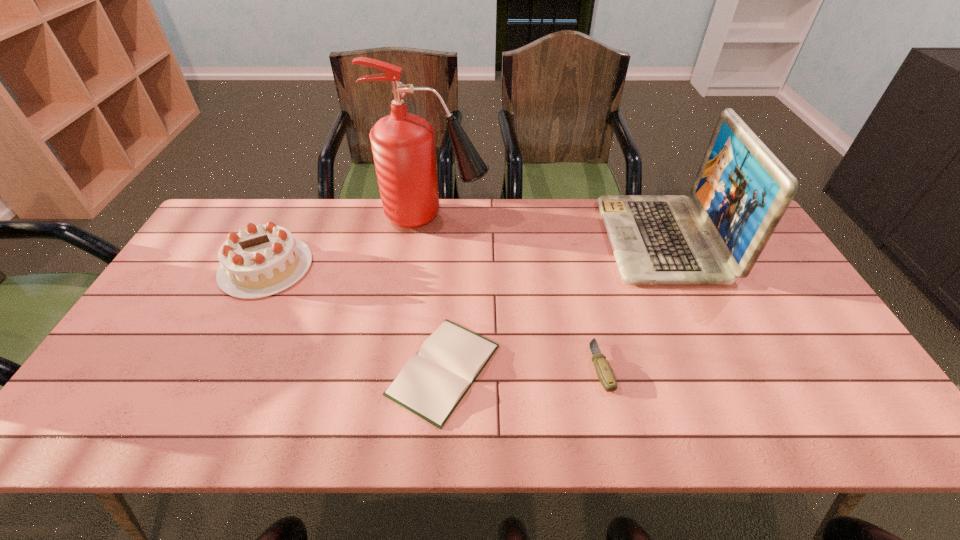
Locate an element on the screen. vacant region that satisfies the following two spatial constraints: 1. on the back side of the pocketknife; 2. with the nozzle aimed from the fire extinguisher is located at coordinates (566, 216).

I want to click on free space that satisfies the following two spatial constraints: 1. with the nozzle aimed from the tallest object; 2. on the left side of the pocketknife, so click(x=417, y=366).